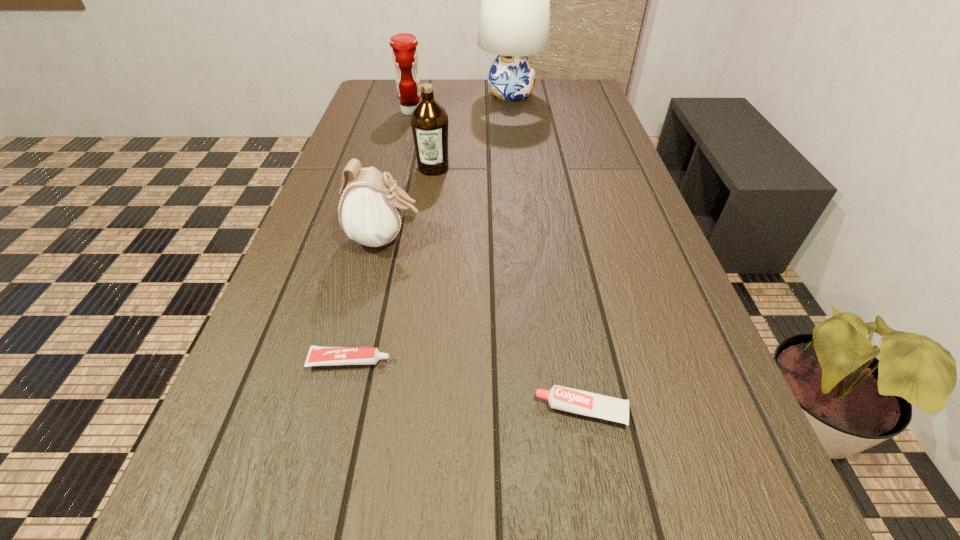
Find the location of a particular element. pouch present at the left edge is located at coordinates (370, 212).

Find the location of a particular element. Image resolution: width=960 pixels, height=540 pixels. toothpaste positioned at the left edge is located at coordinates (318, 356).

The height and width of the screenshot is (540, 960). I want to click on object located in the right edge section of the desktop, so click(x=576, y=401).

Image resolution: width=960 pixels, height=540 pixels. Identify the location of object that is at the far left corner. (405, 56).

I want to click on vacant space at the far edge, so click(460, 105).

You are a GUI agent. You are given a task and a screenshot of the screen. Output one action in this format:
    pyautogui.click(x=<x>, y=<y>)
    Task: Click on the vacant space at the left edge of the desktop
    
    Given the screenshot: What is the action you would take?
    pyautogui.click(x=320, y=200)

This screenshot has width=960, height=540. I want to click on vacant space at the right edge of the desktop, so click(x=570, y=173).

Find the location of a particular element. This screenshot has width=960, height=540. vacant space at the far left corner of the desktop is located at coordinates (389, 86).

Find the location of a particular element. Image resolution: width=960 pixels, height=540 pixels. free space at the far right corner is located at coordinates (554, 97).

Find the location of `unoccupied position between the pouch and the right toothpaste`. unoccupied position between the pouch and the right toothpaste is located at coordinates (484, 325).